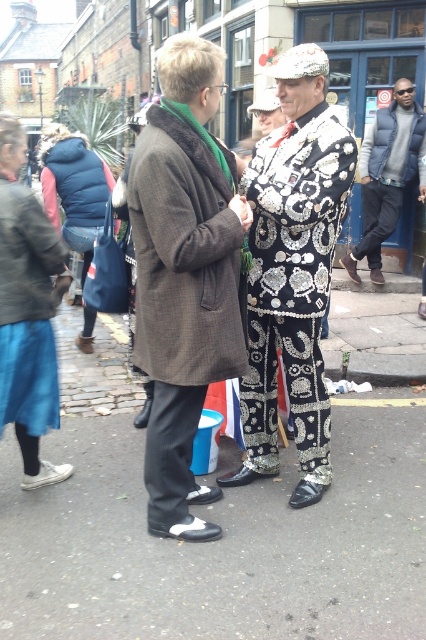
You are standing at the point labeled point (66, 132) and want to walk to the point labeled point (275, 374). Which direction should you move to get closer to your destination?

To move from point (66, 132) to point (275, 374), you should move upwards and to the right since point (275, 374) is closer to the camera than point (66, 132).

You are a photographer trying to capture a candid shot of the denim skirt at left and the matte black jacket at right. Since you want to include both in the frame, which object should you focus on first to ensure both are in the shot?

The denim skirt at left is located below the matte black jacket at right, so you should focus on the matte black jacket at right first to ensure both are in the frame.

You are standing in the street scene and want to walk towards the two points marked in the image. Which point, point (184, 424) or point (34, 323), will you reach first?

Point (184, 424) is closer to the viewer than point (34, 323), so you will reach point (184, 424) first.